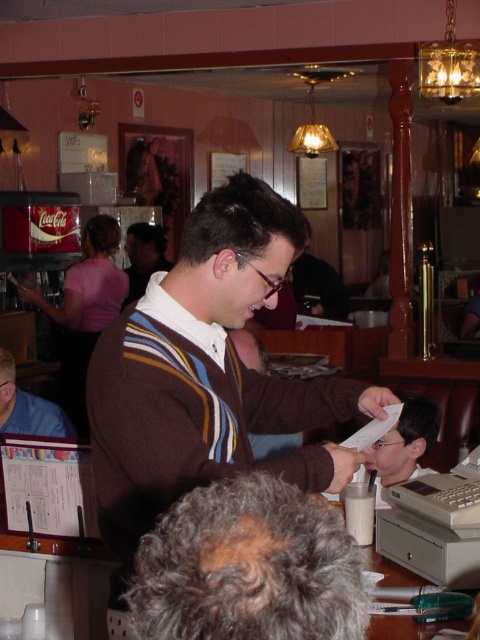
Is point (26, 416) farther from camera compared to point (159, 257)?

No, it is not.

Is dark brown sweater at center thinner than brown sweater at center?

Incorrect, dark brown sweater at center's width is not less than brown sweater at center's.

Describe the element at coordinates (27, 406) in the screenshot. The width and height of the screenshot is (480, 640). I see `dark brown sweater at center` at that location.

Where is `dark brown sweater at center`? dark brown sweater at center is located at coordinates (27, 406).

Is point (248, 529) in front of point (7, 429)?

Yes, it is in front of point (7, 429).

Who is positioned more to the right, gray curly hair at center or dark brown sweater at center?

Positioned to the right is gray curly hair at center.

The width and height of the screenshot is (480, 640). What are the coordinates of `gray curly hair at center` in the screenshot? It's located at (249, 566).

The height and width of the screenshot is (640, 480). I want to click on gray curly hair at center, so click(249, 566).

Which is above, brown striped sweater at center or brown sweater at center?

brown sweater at center is higher up.

Does brown striped sweater at center have a lesser width compared to brown sweater at center?

No.

The height and width of the screenshot is (640, 480). In order to click on brown striped sweater at center in this screenshot , I will do `click(206, 376)`.

Where is `brown striped sweater at center`? The width and height of the screenshot is (480, 640). brown striped sweater at center is located at coordinates (206, 376).